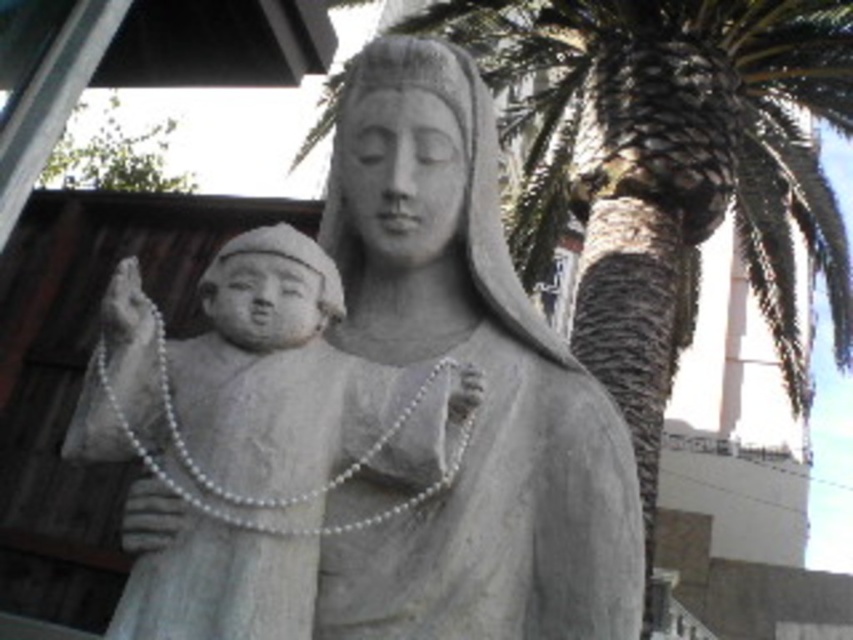
Question: Which point is closer to the camera?

Choices:
 (A) gray stone statue at center
 (B) green leafy palm at upper right

Answer: (A)

Question: Among these objects, which one is farthest from the camera?

Choices:
 (A) white stone child at center
 (B) gray stone statue at center

Answer: (B)

Question: Does gray stone statue at center appear under white stone child at center?

Choices:
 (A) yes
 (B) no

Answer: (B)

Question: Can you confirm if gray stone statue at center is positioned to the right of white stone child at center?

Choices:
 (A) no
 (B) yes

Answer: (B)

Question: From the image, what is the correct spatial relationship of green leafy palm at upper right in relation to white stone child at center?

Choices:
 (A) above
 (B) below

Answer: (A)

Question: Which object appears farthest from the camera in this image?

Choices:
 (A) gray stone statue at center
 (B) green leafy palm at upper right
 (C) white stone child at center

Answer: (B)